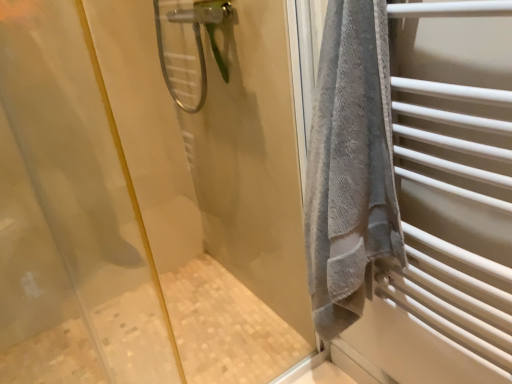
Question: Is clear plastic shower head at upper center inside the boundaries of transparent glass shower door at upper left, or outside?

Choices:
 (A) outside
 (B) inside

Answer: (A)

Question: From the image's perspective, is clear plastic shower head at upper center positioned above or below transparent glass shower door at upper left?

Choices:
 (A) above
 (B) below

Answer: (A)

Question: In the image, is clear plastic shower head at upper center positioned in front of or behind transparent glass shower door at upper left?

Choices:
 (A) behind
 (B) front

Answer: (A)

Question: Considering the positions of point (123, 322) and point (219, 61), is point (123, 322) closer or farther from the camera than point (219, 61)?

Choices:
 (A) farther
 (B) closer

Answer: (A)

Question: Looking at their shapes, would you say transparent glass shower door at upper left is wider or thinner than clear plastic shower head at upper center?

Choices:
 (A) thin
 (B) wide

Answer: (A)

Question: Is transparent glass shower door at upper left inside the boundaries of clear plastic shower head at upper center, or outside?

Choices:
 (A) inside
 (B) outside

Answer: (B)

Question: In the image, is transparent glass shower door at upper left positioned in front of or behind clear plastic shower head at upper center?

Choices:
 (A) front
 (B) behind

Answer: (A)